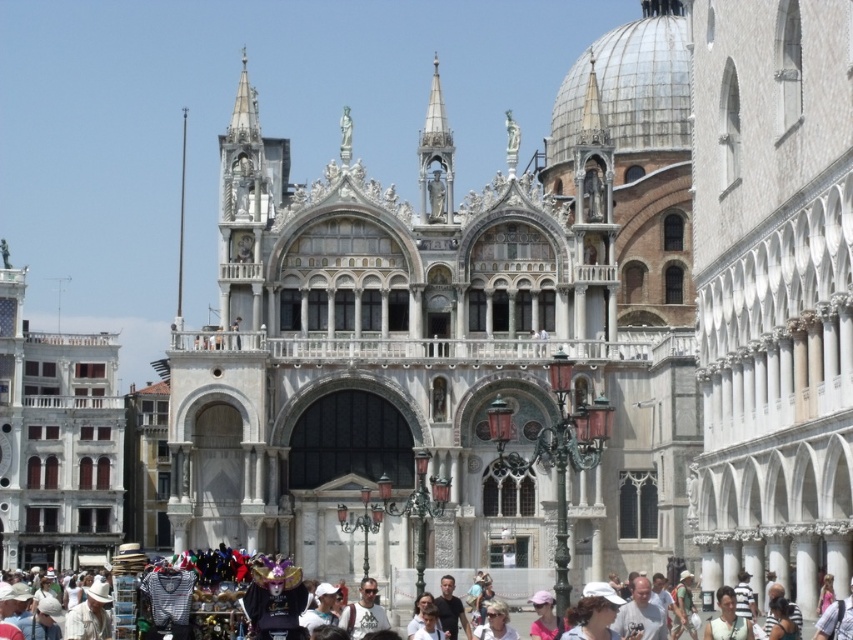
You are standing in front of the grand building and want to take a photo of the white marble building at left without the white cotton hats at lower center blocking the view. Based on their positions, is this possible?

The white marble building at left is positioned over the white cotton hats at lower center, so taking a photo from a lower angle might allow capturing the building without the hats obstructing the view.

Based on the photo, you are standing in front of the grand building and notice the white marble palace at center and the white cotton hats at lower center. Which object is located to the right of the other?

The white marble palace at center is positioned on the right side of white cotton hats at lower center.